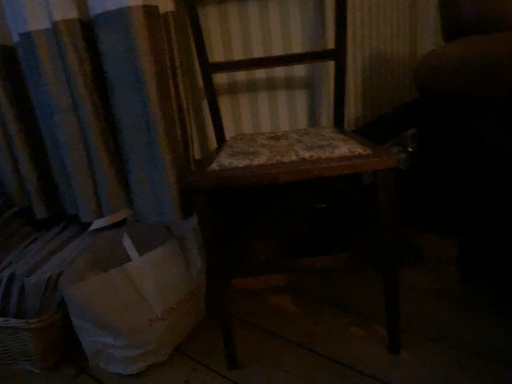
Question: From a real-world perspective, is white paper bag at lower left physically located above or below wooden chair at center?

Choices:
 (A) above
 (B) below

Answer: (B)

Question: Is white paper bag at lower left in front of or behind wooden chair at center in the image?

Choices:
 (A) behind
 (B) front

Answer: (A)

Question: Which is correct: white paper bag at lower left is inside wooden chair at center, or outside of it?

Choices:
 (A) outside
 (B) inside

Answer: (A)

Question: Considering their positions, is wooden chair at center located in front of or behind white paper bag at lower left?

Choices:
 (A) behind
 (B) front

Answer: (B)

Question: Is wooden chair at center wider or thinner than white paper bag at lower left?

Choices:
 (A) thin
 (B) wide

Answer: (B)

Question: In terms of size, does wooden chair at center appear bigger or smaller than white paper bag at lower left?

Choices:
 (A) small
 (B) big

Answer: (B)

Question: From a real-world perspective, relative to white paper bag at lower left, is wooden chair at center vertically above or below?

Choices:
 (A) below
 (B) above

Answer: (B)